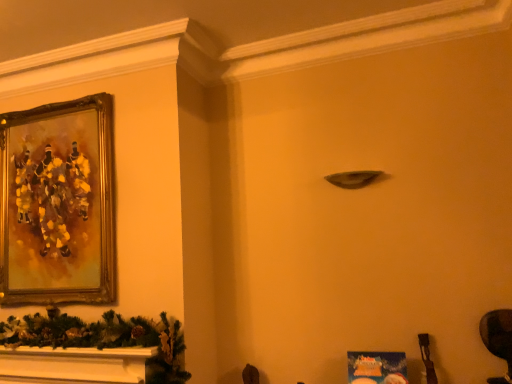
Locate an element on the screen. The height and width of the screenshot is (384, 512). free point above gold-framed painting at upper left (from a real-world perspective) is located at coordinates (41, 96).